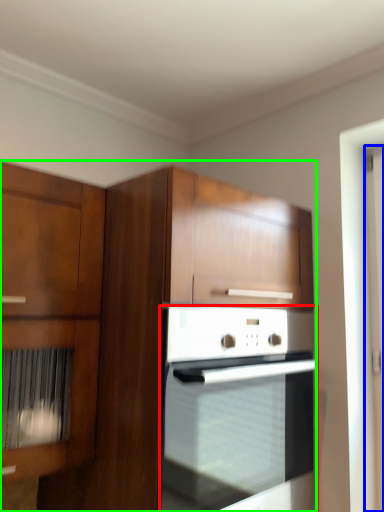
Question: Estimate the real-world distances between objects in this image. Which object is closer to oven (highlighted by a red box), screen door (highlighted by a blue box) or cabinetry (highlighted by a green box)?

Choices:
 (A) screen door
 (B) cabinetry

Answer: (B)